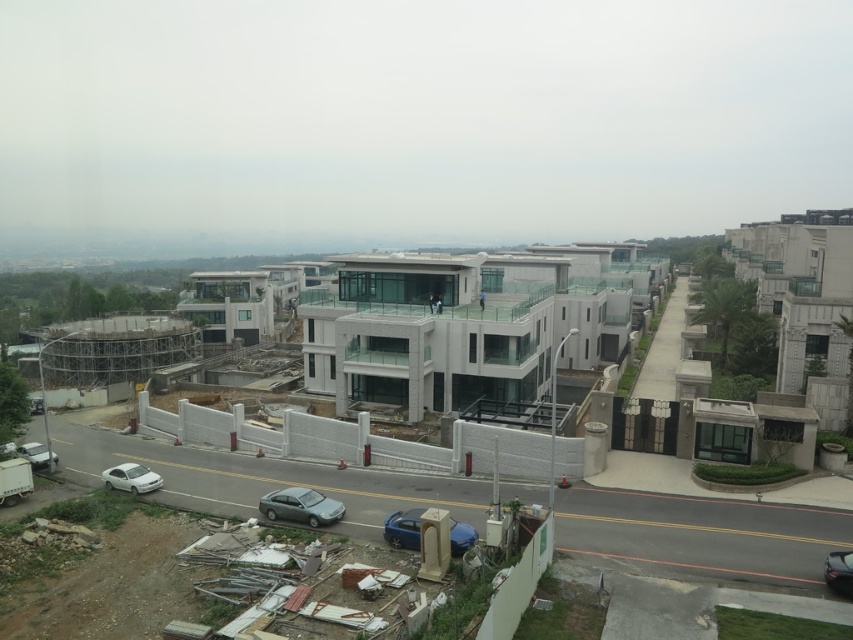
Question: From the image, what is the correct spatial relationship of satin silver sedan at center in relation to white matte car at lower left?

Choices:
 (A) right
 (B) left

Answer: (A)

Question: Which object is the farthest from the white concrete construction site at center?

Choices:
 (A) white matte car at lower left
 (B) silver metallic car at lower left
 (C) white glossy sedan at lower left

Answer: (A)

Question: Does white glossy sedan at lower left lie in front of silver metallic car at lower left?

Choices:
 (A) no
 (B) yes

Answer: (B)

Question: Which is nearer to the white glossy sedan at lower left?

Choices:
 (A) metallic blue sedan at center
 (B) white matte car at lower left
 (C) satin silver sedan at center

Answer: (C)

Question: Is metallic blue sedan at center in front of white glossy sedan at lower left?

Choices:
 (A) no
 (B) yes

Answer: (B)

Question: Among these objects, which one is nearest to the camera?

Choices:
 (A) shiny black car at lower right
 (B) white matte car at lower left
 (C) metallic blue sedan at center
 (D) satin silver sedan at center

Answer: (A)